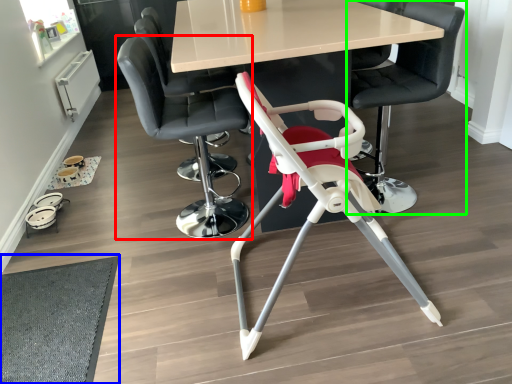
Question: Which is farther away from chair (highlighted by a red box)? mat (highlighted by a blue box) or chair (highlighted by a green box)?

Choices:
 (A) mat
 (B) chair

Answer: (B)